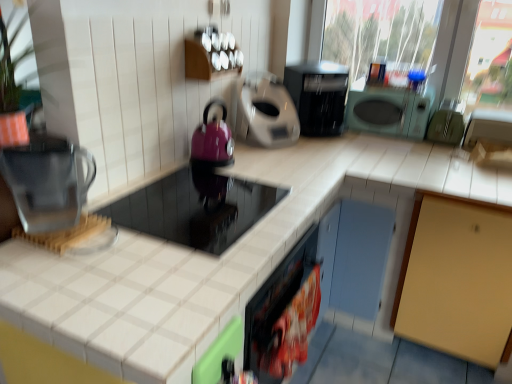
Identify the location of free spot below transparent plastic water filter at left (from a real-world perspective). This screenshot has height=384, width=512. (72, 226).